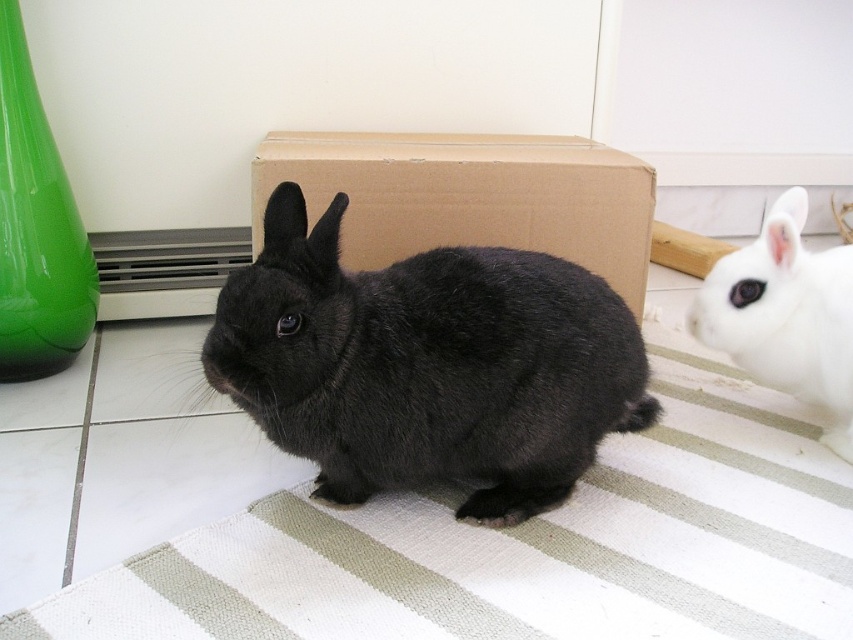
You are standing at the entrance of the room and see the white textured mat at center. Can you determine its exact coordinates in the room?

The white textured mat at center is located at point coordinates of (524, 547).

You are a photographer setting up a shot of the two rabbits. You want to ensure the black furry rabbit at center is positioned to the left of the white textured mat at center. Is this already the case in the current setup?

Yes, the black furry rabbit at center is to the left of the white textured mat at center, so the current setup already meets your requirement.